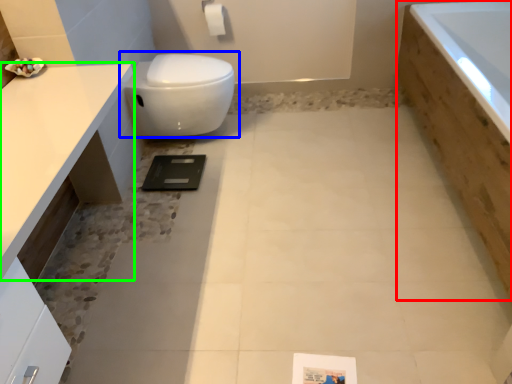
Question: Which object is the closest to the bath (highlighted by a red box)? Choose among these: toilet (highlighted by a blue box) or countertop (highlighted by a green box).

Choices:
 (A) toilet
 (B) countertop

Answer: (A)